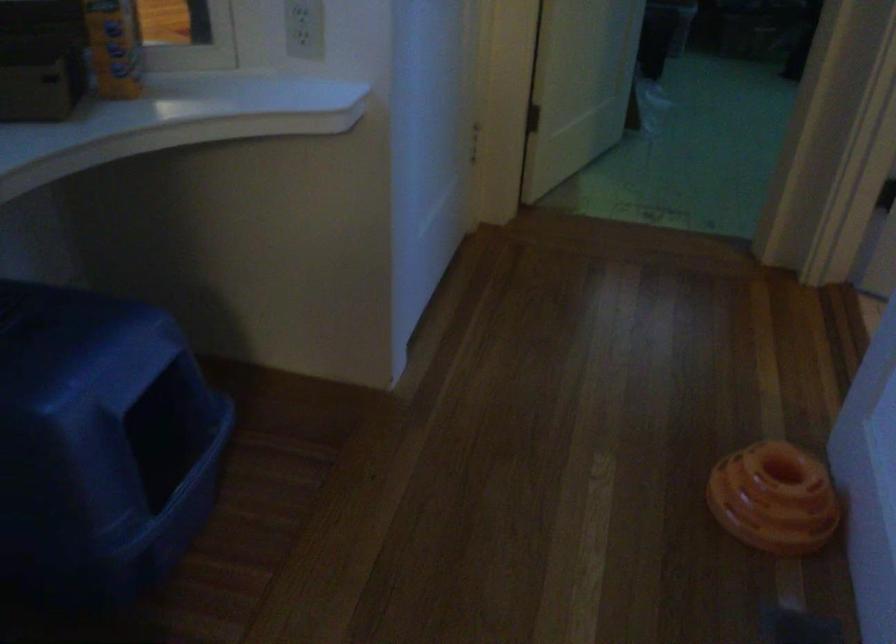
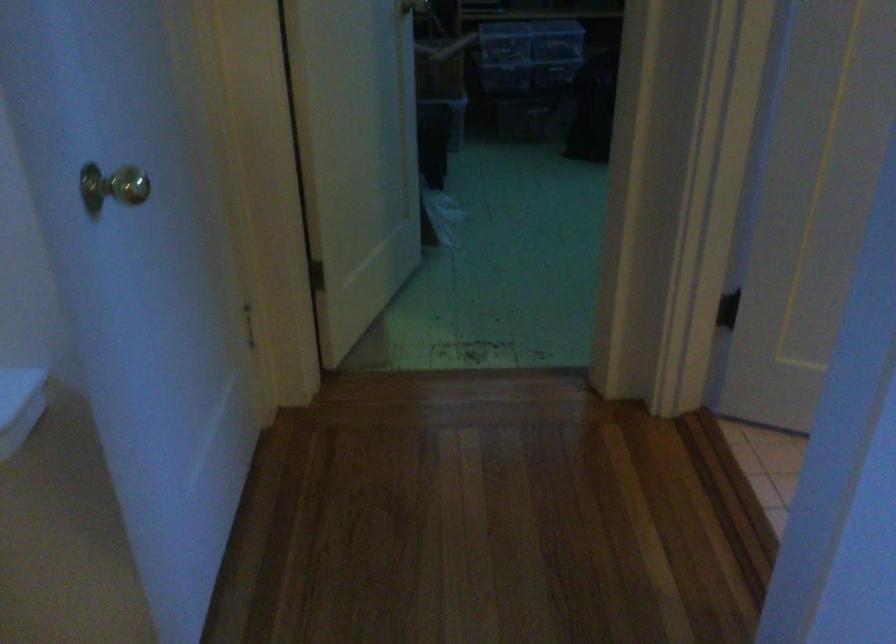
Question: The camera is either moving clockwise (left) or counter-clockwise (right) around the object. The first image is from the beginning of the video and the second image is from the end. Is the camera moving left or right when shooting the video?

Choices:
 (A) Left
 (B) Right

Answer: (A)